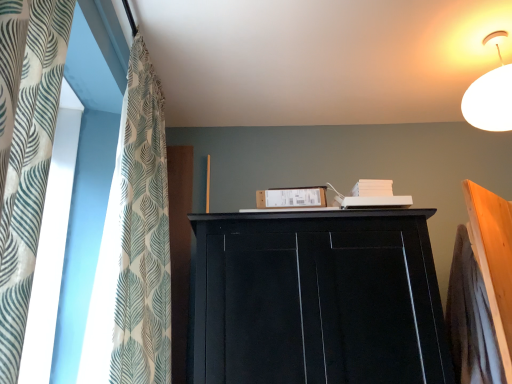
Question: From a real-world perspective, is black matte cupboard at upper center located higher than white textured fabric at left?

Choices:
 (A) no
 (B) yes

Answer: (A)

Question: Does black matte cupboard at upper center touch white textured fabric at left?

Choices:
 (A) no
 (B) yes

Answer: (A)

Question: Is black matte cupboard at upper center positioned with its back to white textured fabric at left?

Choices:
 (A) yes
 (B) no

Answer: (B)

Question: From the image's perspective, does black matte cupboard at upper center appear lower than white textured fabric at left?

Choices:
 (A) no
 (B) yes

Answer: (B)

Question: Is black matte cupboard at upper center bigger than white textured fabric at left?

Choices:
 (A) no
 (B) yes

Answer: (B)

Question: Is black matte cupboard at upper center positioned in front of white textured fabric at left?

Choices:
 (A) yes
 (B) no

Answer: (B)

Question: Is white textured fabric at left wider than black matte cupboard at upper center?

Choices:
 (A) no
 (B) yes

Answer: (A)

Question: Can you confirm if white textured fabric at left is bigger than black matte cupboard at upper center?

Choices:
 (A) no
 (B) yes

Answer: (A)

Question: From a real-world perspective, is white textured fabric at left beneath black matte cupboard at upper center?

Choices:
 (A) no
 (B) yes

Answer: (A)

Question: Are white textured fabric at left and black matte cupboard at upper center far apart?

Choices:
 (A) no
 (B) yes

Answer: (A)

Question: From the image's perspective, is white textured fabric at left under black matte cupboard at upper center?

Choices:
 (A) no
 (B) yes

Answer: (A)

Question: Is white textured fabric at left at the right side of black matte cupboard at upper center?

Choices:
 (A) no
 (B) yes

Answer: (A)

Question: Considering the positions of black matte cupboard at upper center and white textured fabric at left in the image, is black matte cupboard at upper center taller or shorter than white textured fabric at left?

Choices:
 (A) tall
 (B) short

Answer: (B)